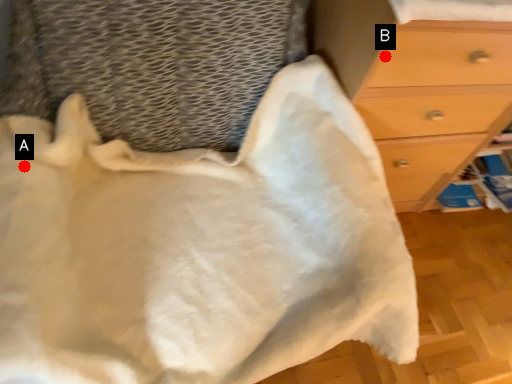
Question: Two points are circled on the image, labeled by A and B beside each circle. Which point appears closest to the camera in this image?

Choices:
 (A) A is closer
 (B) B is closer

Answer: (A)